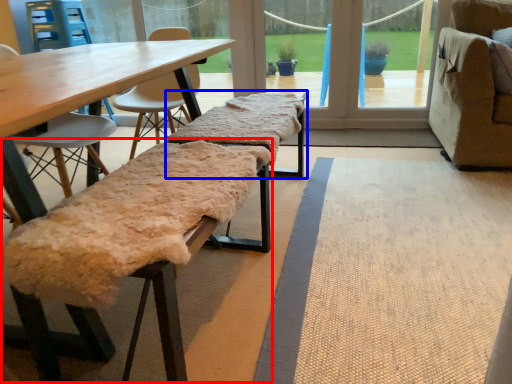
Question: Which point is further to the camera, park bench (highlighted by a red box) or park bench (highlighted by a blue box)?

Choices:
 (A) park bench
 (B) park bench

Answer: (B)